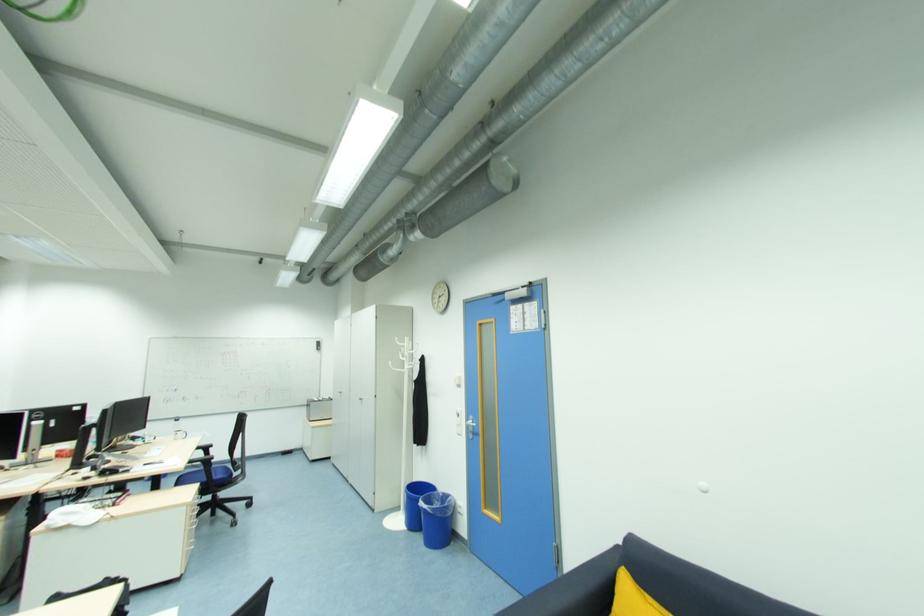
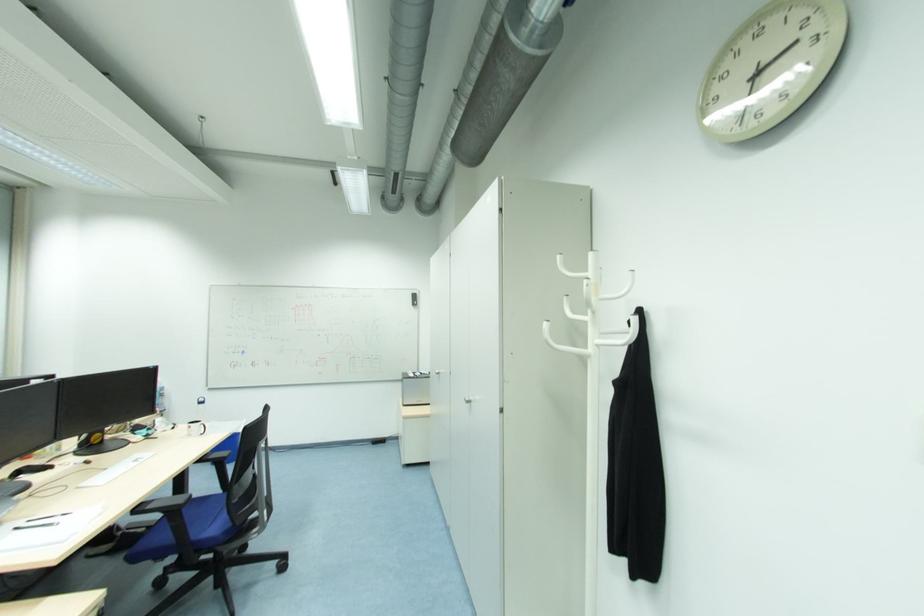
Where in the second image is the point corresponding to [365,399] from the first image?

(473, 400)